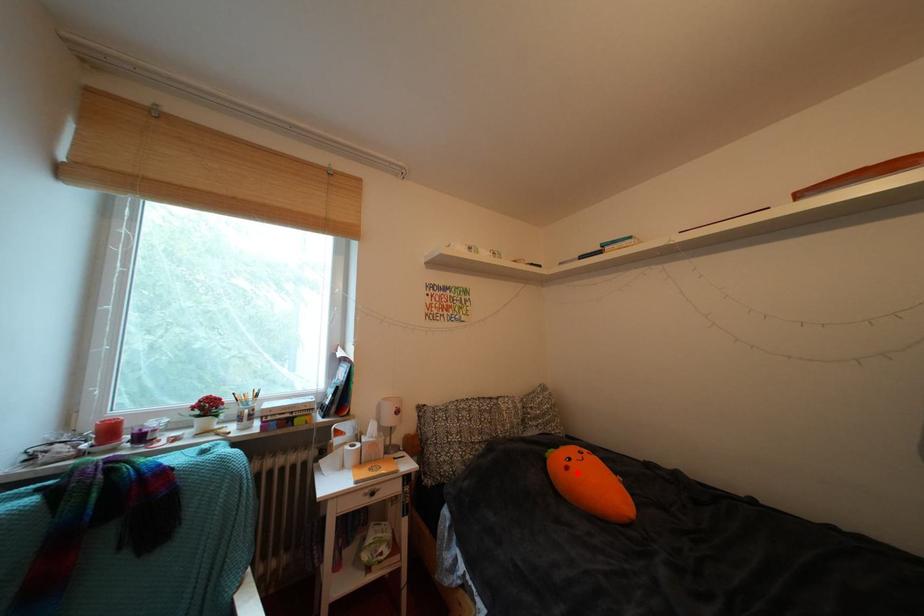
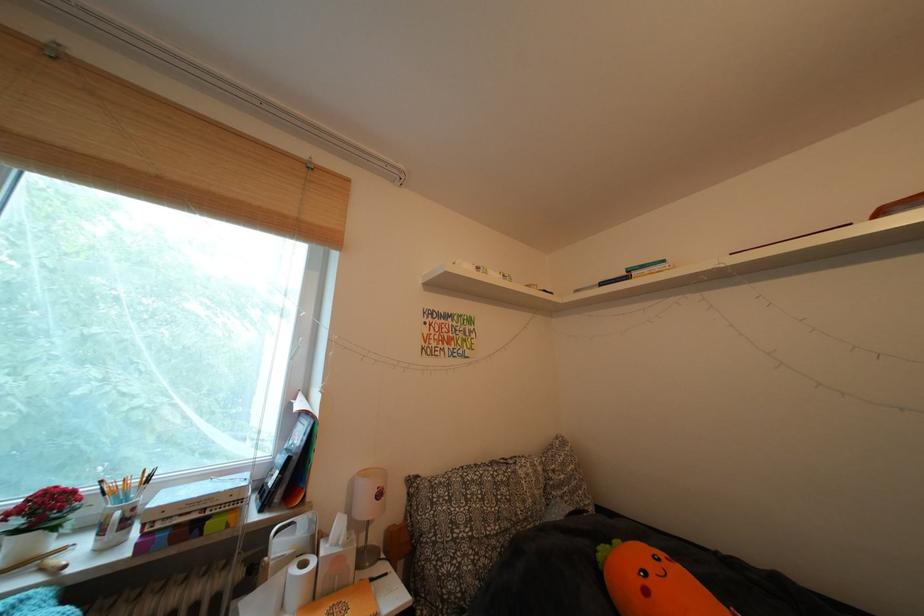
In the second image, find the point that corresponds to the highlighted location in the first image.

(657, 597)